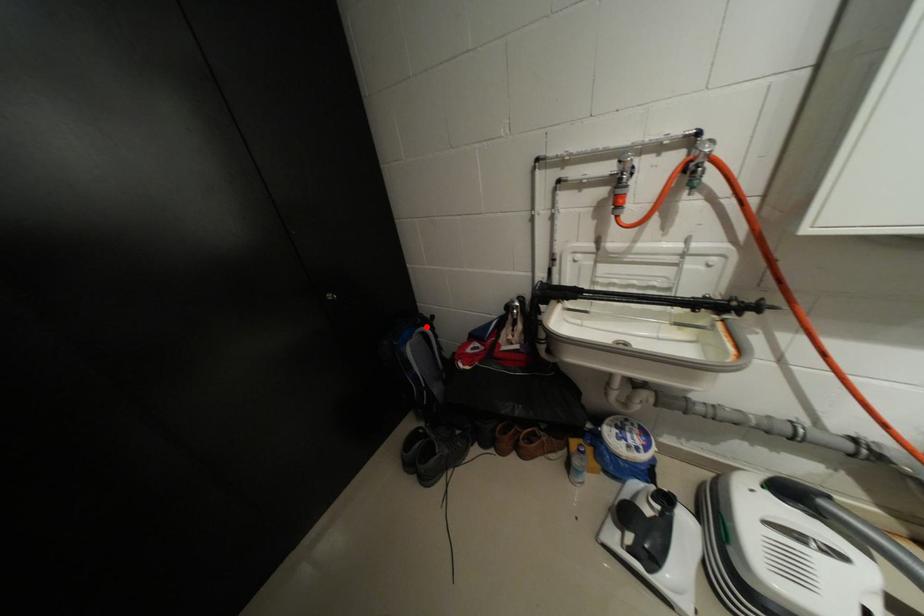
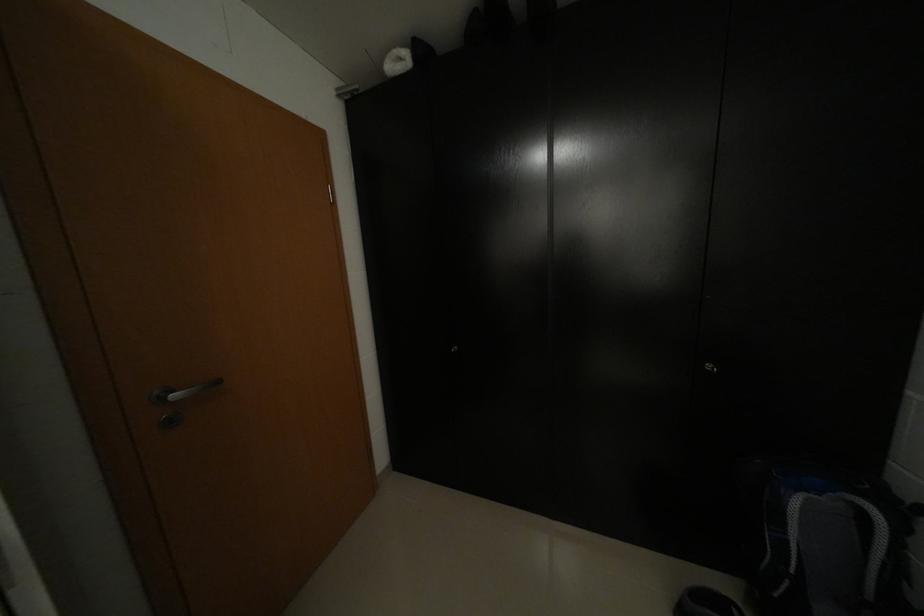
Locate, in the second image, the point that corresponds to the highlighted location in the first image.

(867, 495)